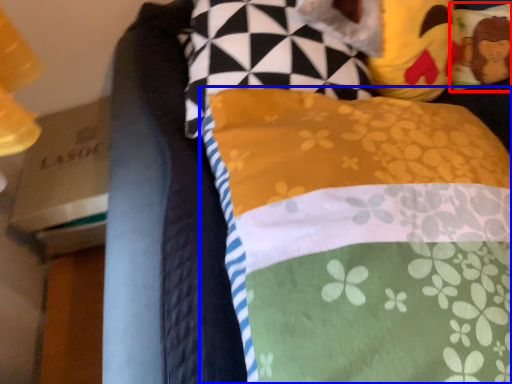
Question: Which of the following is the farthest to the observer, pillow (highlighted by a red box) or pillow (highlighted by a blue box)?

Choices:
 (A) pillow
 (B) pillow

Answer: (A)